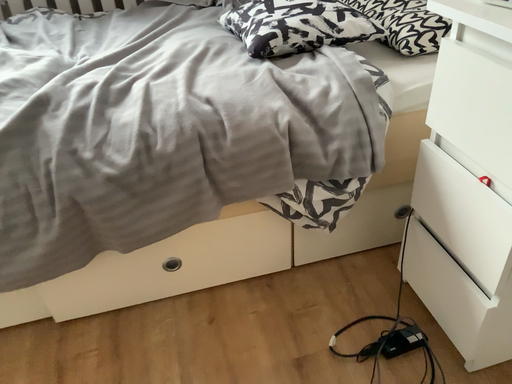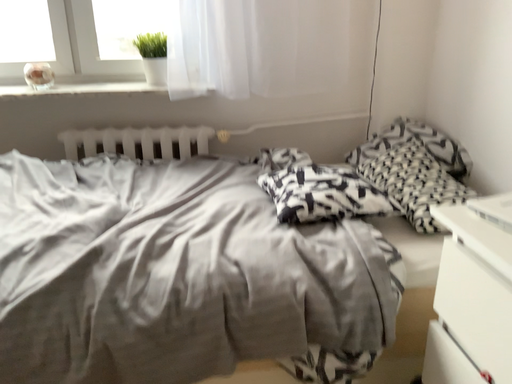
Question: Which way did the camera rotate in the video?

Choices:
 (A) rotated upward
 (B) rotated downward

Answer: (A)